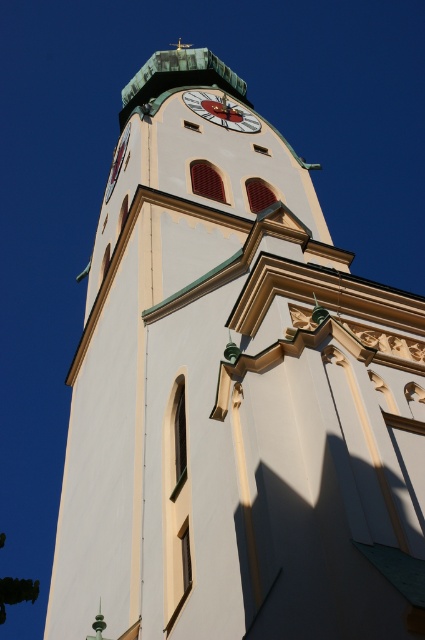
Question: Does white glossy clock at upper center appear on the right side of white painted clock at upper center?

Choices:
 (A) yes
 (B) no

Answer: (A)

Question: Which object appears closest to the camera in this image?

Choices:
 (A) white glossy clock at upper center
 (B) white painted clock at upper center

Answer: (B)

Question: Which point is closer to the camera?

Choices:
 (A) white painted clock at upper center
 (B) white glossy clock at upper center

Answer: (A)

Question: Can you confirm if white glossy clock at upper center is positioned below white painted clock at upper center?

Choices:
 (A) no
 (B) yes

Answer: (B)

Question: Is white glossy clock at upper center wider than white painted clock at upper center?

Choices:
 (A) no
 (B) yes

Answer: (A)